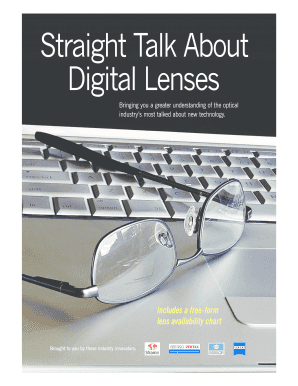
The width and height of the screenshot is (298, 386). Identify the location of keyboard. (119, 185).